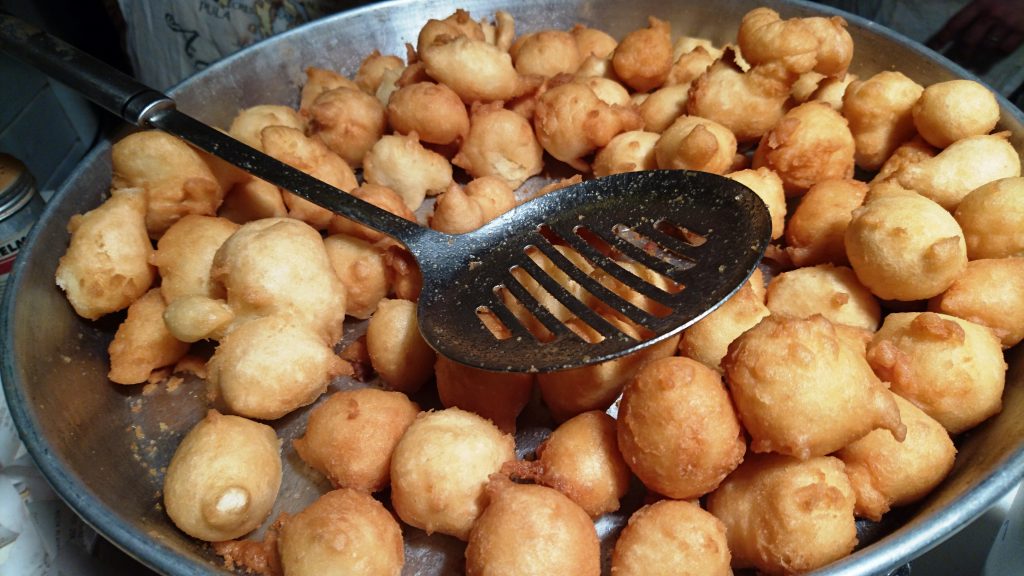
This screenshot has width=1024, height=576. In order to click on metalic bowl in this screenshot , I will do `click(56, 351)`.